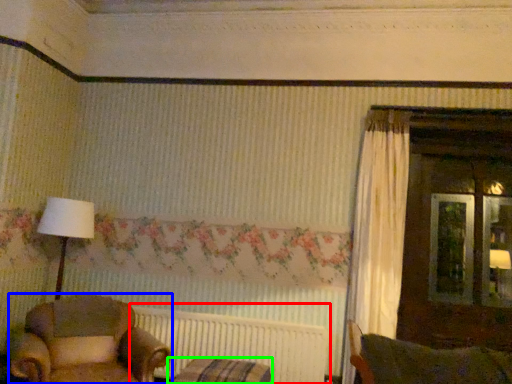
Question: Which object is positioned closest to radiator (highlighted by a red box)? Select from chair (highlighted by a blue box) and furniture (highlighted by a green box).

Choices:
 (A) chair
 (B) furniture

Answer: (B)